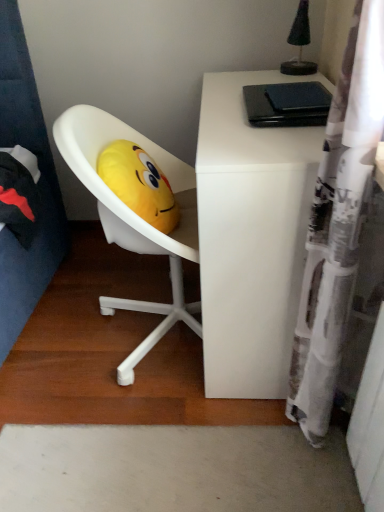
Question: Does yellow plush at center have a greater height compared to white matte desk at upper right?

Choices:
 (A) no
 (B) yes

Answer: (A)

Question: From the image's perspective, is yellow plush at center beneath white matte desk at upper right?

Choices:
 (A) yes
 (B) no

Answer: (B)

Question: Is yellow plush at center placed right next to white matte desk at upper right?

Choices:
 (A) no
 (B) yes

Answer: (A)

Question: Does yellow plush at center have a smaller size compared to white matte desk at upper right?

Choices:
 (A) yes
 (B) no

Answer: (A)

Question: Does yellow plush at center have a greater width compared to white matte desk at upper right?

Choices:
 (A) yes
 (B) no

Answer: (B)

Question: Is yellow plush at center in front of white matte desk at upper right?

Choices:
 (A) no
 (B) yes

Answer: (A)

Question: Can you confirm if white printed fabric shower curtain at right is positioned to the right of yellow plush at center?

Choices:
 (A) no
 (B) yes

Answer: (B)

Question: Is white printed fabric shower curtain at right not within yellow plush at center?

Choices:
 (A) yes
 (B) no

Answer: (A)

Question: Is white printed fabric shower curtain at right oriented towards yellow plush at center?

Choices:
 (A) no
 (B) yes

Answer: (B)

Question: Can you confirm if white printed fabric shower curtain at right is wider than yellow plush at center?

Choices:
 (A) yes
 (B) no

Answer: (B)

Question: Does white printed fabric shower curtain at right contain yellow plush at center?

Choices:
 (A) yes
 (B) no

Answer: (B)

Question: From a real-world perspective, is white printed fabric shower curtain at right on top of yellow plush at center?

Choices:
 (A) yes
 (B) no

Answer: (B)

Question: Is white printed fabric shower curtain at right bigger than white matte desk at upper right?

Choices:
 (A) no
 (B) yes

Answer: (A)